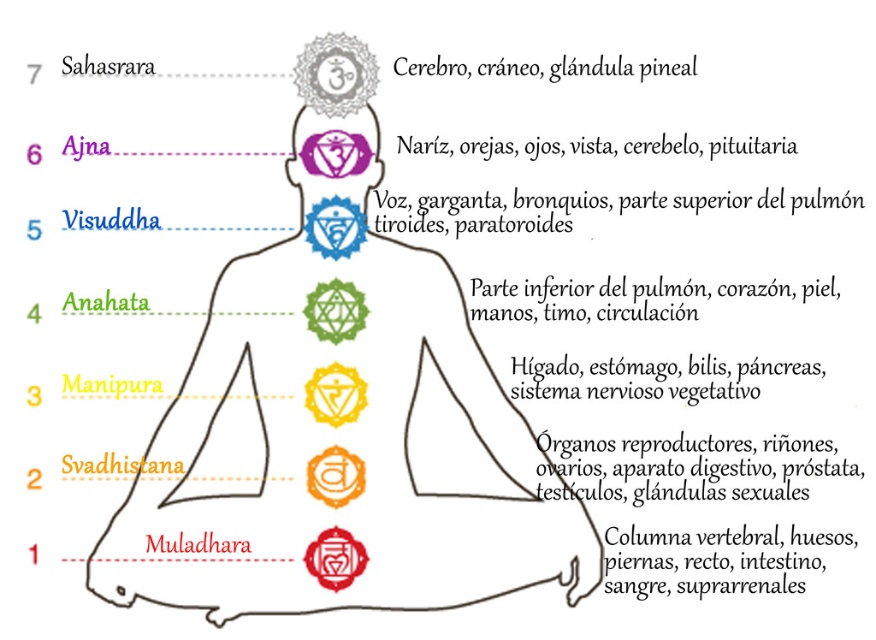
Is green glossy chakra at center thinner than red glossy circle at lower center?

Correct, green glossy chakra at center's width is less than red glossy circle at lower center's.

Can you confirm if green glossy chakra at center is taller than red glossy circle at lower center?

No.

Which is in front, point (361, 323) or point (350, 547)?

Positioned in front is point (361, 323).

At what (x,y) coordinates should I click in order to perform the action: click on green glossy chakra at center. Please return your answer as a coordinate pair (x, y). Looking at the image, I should click on (336, 310).

Does point (326, 547) come closer to viewer compared to point (336, 484)?

That is False.

Does point (359, 572) come behind point (343, 492)?

That is False.

What do you see at coordinates (336, 557) in the screenshot?
I see `red glossy circle at lower center` at bounding box center [336, 557].

The image size is (876, 640). Identify the location of red glossy circle at lower center. (336, 557).

Is green glossy chakra at center taller than orange glossy chakra at center?

No.

Who is lower down, green glossy chakra at center or orange glossy chakra at center?

orange glossy chakra at center is lower down.

Between point (336, 308) and point (352, 461), which one is positioned in front?

Point (336, 308) is more forward.

Image resolution: width=876 pixels, height=640 pixels. In order to click on green glossy chakra at center in this screenshot , I will do `click(336, 310)`.